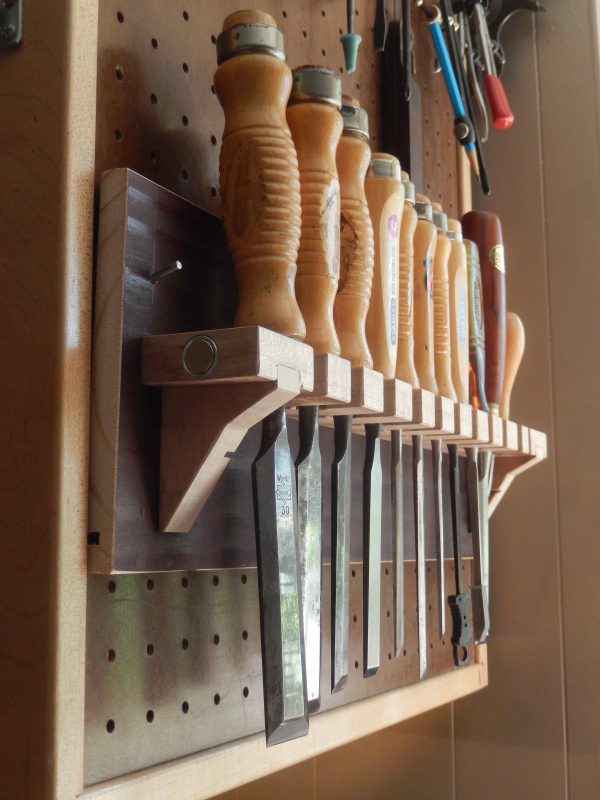
You are a GUI agent. You are given a task and a screenshot of the screen. Output one action in this format:
    pyautogui.click(x=<x>, y=<y>)
    Task: Click on the handle
    
    Given the screenshot: What is the action you would take?
    pyautogui.click(x=278, y=284)